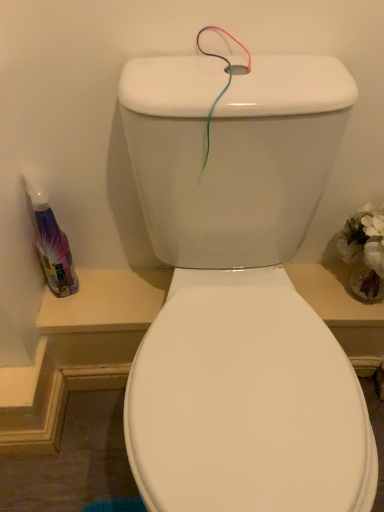
You are a GUI agent. You are given a task and a screenshot of the screen. Output one action in this format:
    pyautogui.click(x=<x>, y=<y>)
    Task: Click on the vacant area that lies in front of purple glossy spray bottle at left
    The height and width of the screenshot is (512, 384).
    Given the screenshot: What is the action you would take?
    pyautogui.click(x=59, y=311)